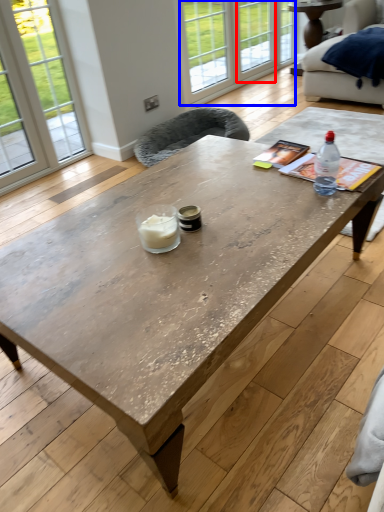
Question: Which of the following is the closest to the observer, window (highlighted by a red box) or glass door (highlighted by a blue box)?

Choices:
 (A) window
 (B) glass door

Answer: (B)